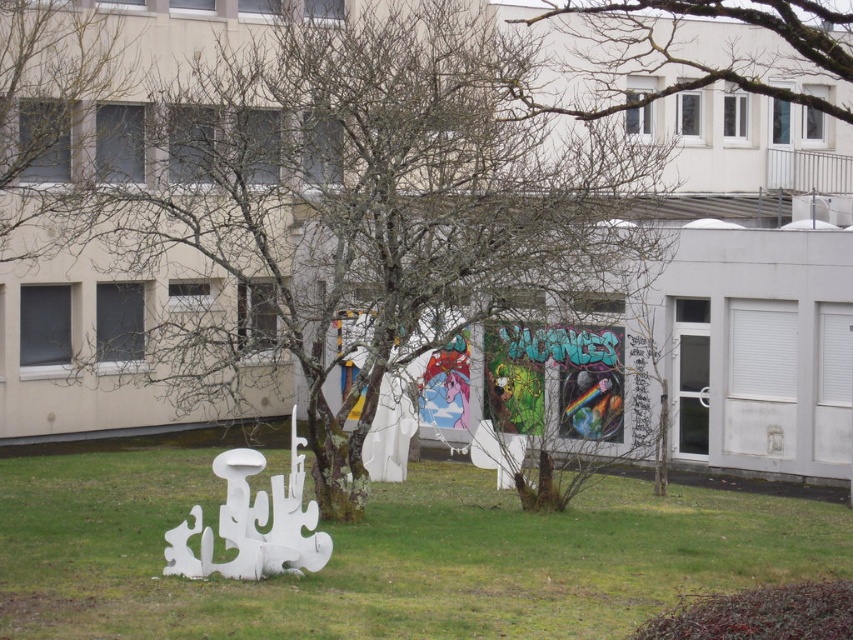
Question: Which of the following is the closest to the observer?

Choices:
 (A) bare branches at upper center
 (B) green grass at lower center

Answer: (B)

Question: Is green grass at lower center wider than bare branches at upper center?

Choices:
 (A) no
 (B) yes

Answer: (B)

Question: Among these points, which one is nearest to the camera?

Choices:
 (A) (515, 273)
 (B) (25, 42)

Answer: (A)

Question: Can you confirm if bare branches at center is smaller than bare branches at upper left?

Choices:
 (A) yes
 (B) no

Answer: (B)

Question: Considering the relative positions of bare branches at upper left and bare branches at upper center in the image provided, where is bare branches at upper left located with respect to bare branches at upper center?

Choices:
 (A) left
 (B) right

Answer: (A)

Question: Which point is farther from the camera taking this photo?

Choices:
 (A) (431, 44)
 (B) (741, 515)

Answer: (B)